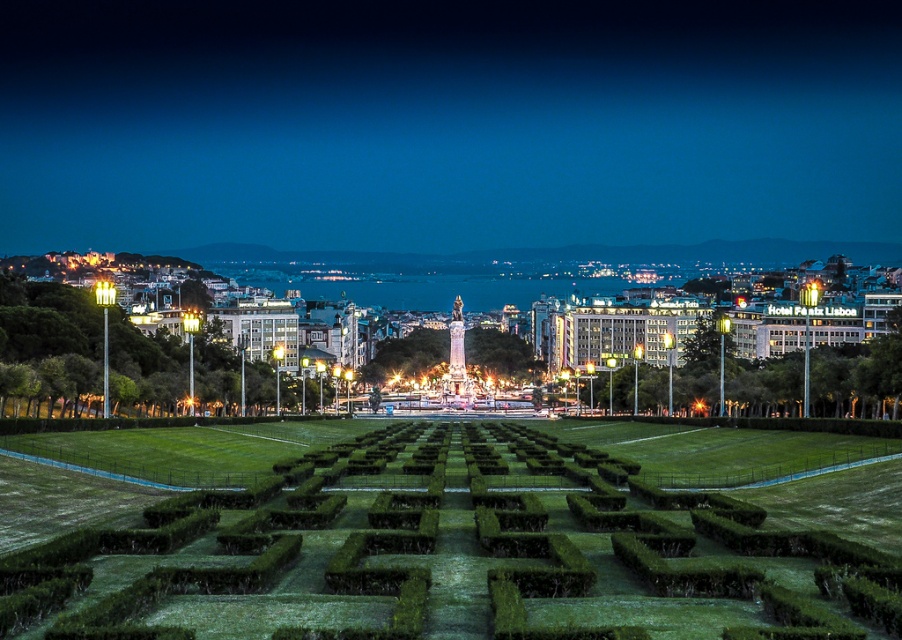
Based on the photo, you are a gardener planning to trim the green grass hedge at left and the green grass hedge at center to ensure uniformity. Which hedge requires more trimming to match the other in width?

The green grass hedge at left is wider than the green grass hedge at center, so the green grass hedge at left requires more trimming to match the green grass hedge at center in width.